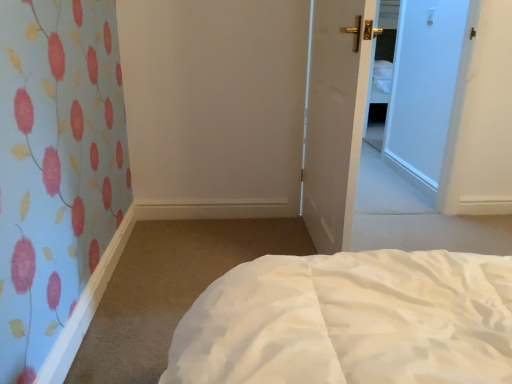
The width and height of the screenshot is (512, 384). What are the coordinates of `vacant area situated to the left side of white matte door at center` in the screenshot? It's located at (190, 260).